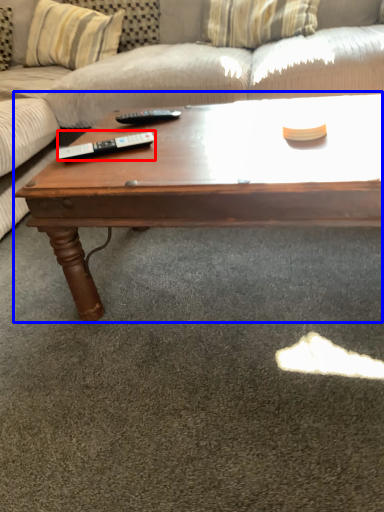
Question: Which point is closer to the camera, remote (highlighted by a red box) or coffee table (highlighted by a blue box)?

Choices:
 (A) remote
 (B) coffee table

Answer: (B)